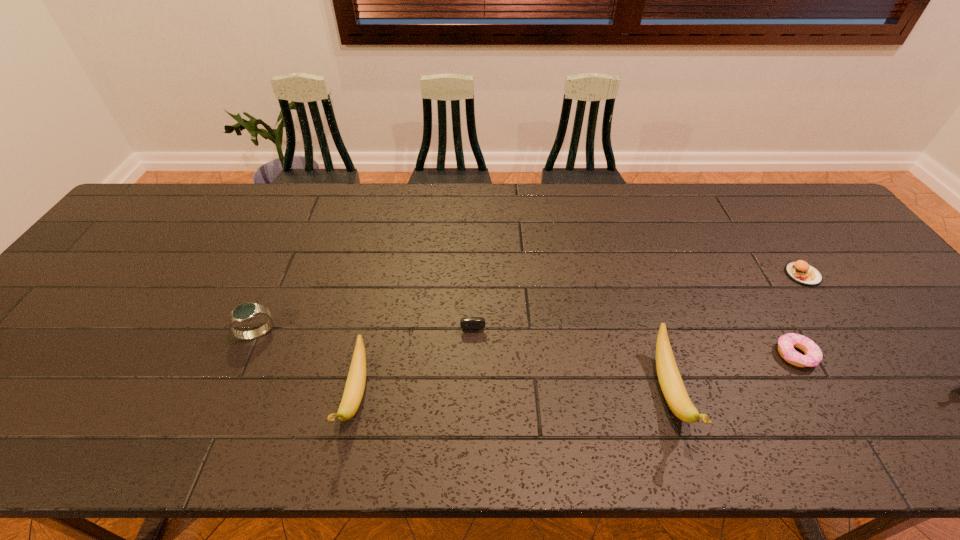
Identify the location of vacant space in between the fifth shortest object and the watch. (306, 364).

This screenshot has height=540, width=960. I want to click on free area in between the right banana and the shortest object, so click(x=732, y=374).

This screenshot has width=960, height=540. I want to click on vacant point located between the third object from left to right and the right banana, so click(x=569, y=348).

You are a GUI agent. You are given a task and a screenshot of the screen. Output one action in this format:
    pyautogui.click(x=<x>, y=<y>)
    Task: Click on the free point between the rightmost object and the fourth shortest object
    The image size is (960, 540).
    Given the screenshot: What is the action you would take?
    pyautogui.click(x=530, y=304)

You are a GUI agent. You are given a task and a screenshot of the screen. Output one action in this format:
    pyautogui.click(x=<x>, y=<y>)
    Task: Click on the free space between the second tallest object and the right banana
    This screenshot has width=960, height=540.
    Given the screenshot: What is the action you would take?
    pyautogui.click(x=513, y=394)

I want to click on object that can be found as the fourth closest to the watch, so click(x=813, y=356).

Identify which object is the second closest to the third tallest object. Please provide its 2D coordinates. Your answer should be formatted as a tuple, i.e. [(x, y)], where the tuple contains the x and y coordinates of a point satisfying the conditions above.

[(468, 322)]

Locate which banana is the closest to the patty. Please provide its 2D coordinates. Your answer should be formatted as a tuple, i.e. [(x, y)], where the tuple contains the x and y coordinates of a point satisfying the conditions above.

[(672, 386)]

Point out which banana is positioned as the second nearest to the patty. Please provide its 2D coordinates. Your answer should be formatted as a tuple, i.e. [(x, y)], where the tuple contains the x and y coordinates of a point satisfying the conditions above.

[(354, 389)]